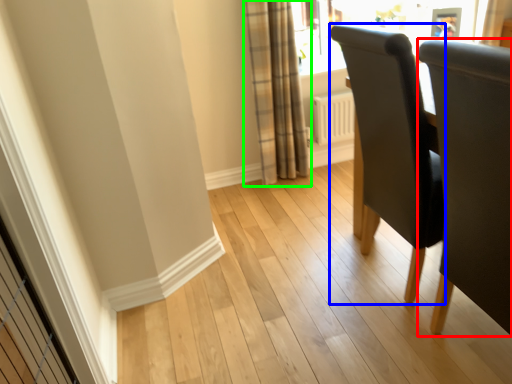
Question: Which object is the closest to the chair (highlighted by a red box)? Choose among these: chair (highlighted by a blue box) or curtain (highlighted by a green box).

Choices:
 (A) chair
 (B) curtain

Answer: (A)